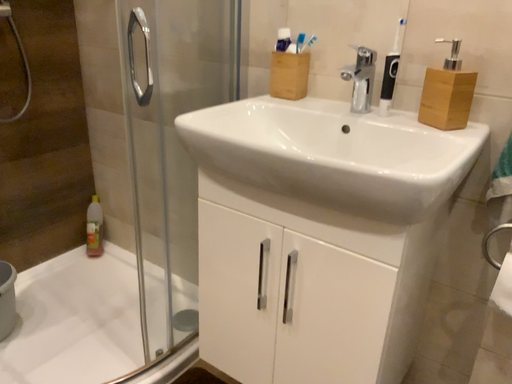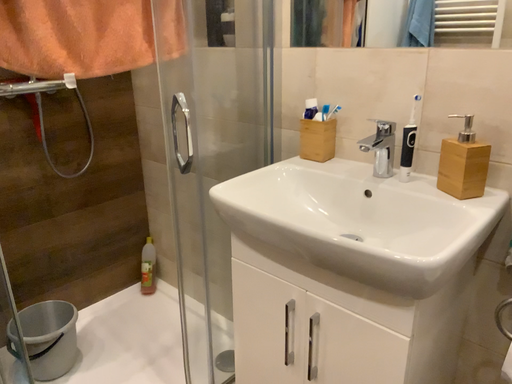
Question: Which way did the camera rotate in the video?

Choices:
 (A) rotated left
 (B) rotated right

Answer: (A)